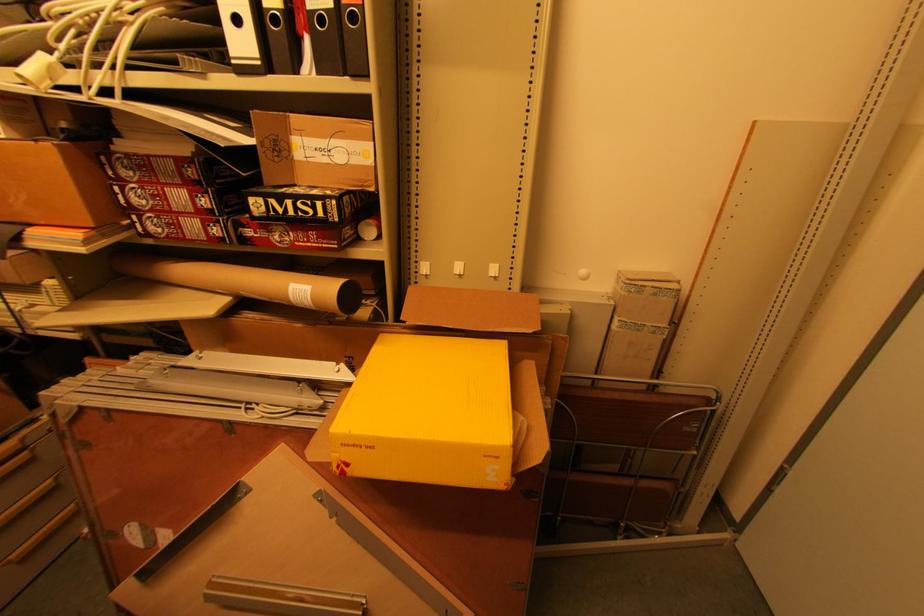
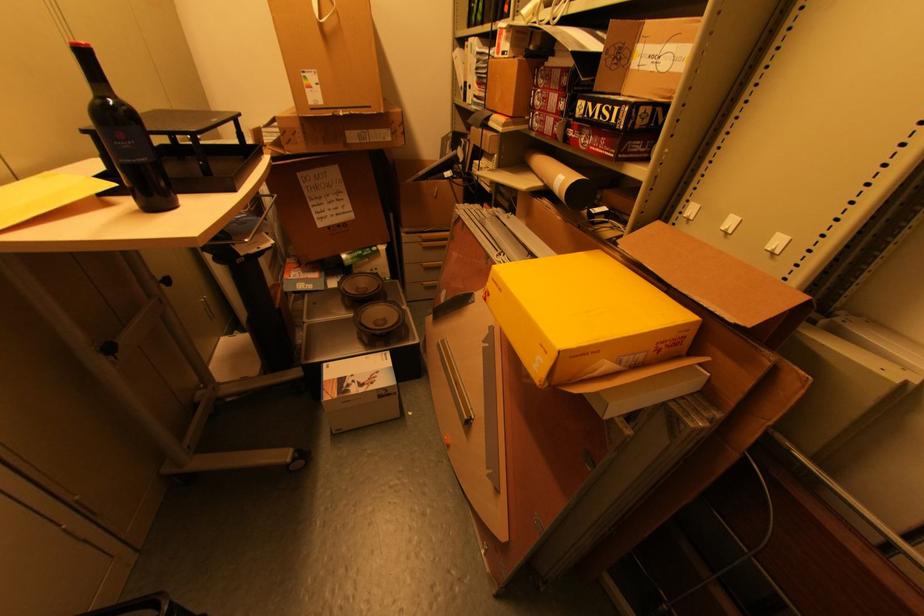
In the second image, find the point that corresponds to the point at 187,270 in the first image.

(542, 161)